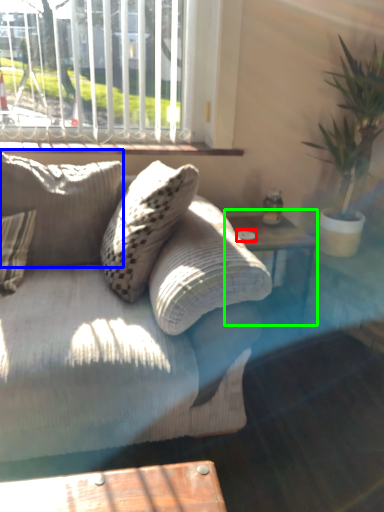
Question: Which object is the closest to the glass plate (highlighted by a red box)? Choose among these: pillow (highlighted by a blue box) or table (highlighted by a green box).

Choices:
 (A) pillow
 (B) table

Answer: (B)